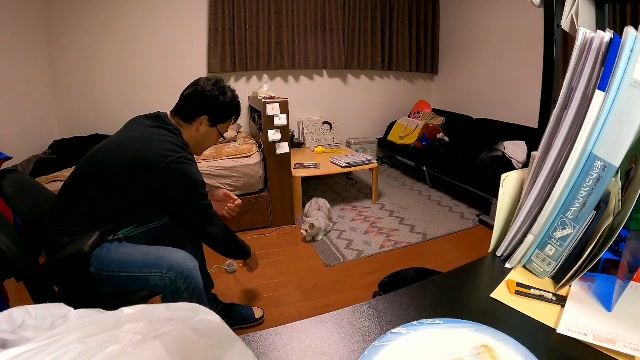
What are the coordinates of `reflected light on black table surface` in the screenshot? It's located at (305, 343).